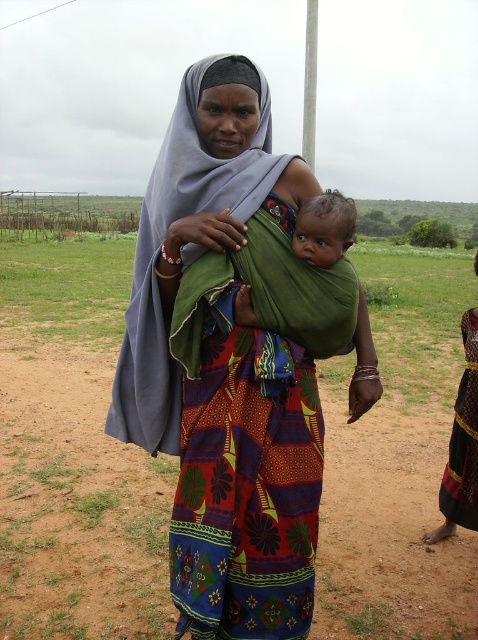
Is point (219, 593) closer to camera compared to point (477, 342)?

Yes, point (219, 593) is in front of point (477, 342).

Is point (189, 468) positioned in front of point (443, 477)?

Yes, it is.

Where is `multicolored fabric dress at center`? multicolored fabric dress at center is located at coordinates (235, 358).